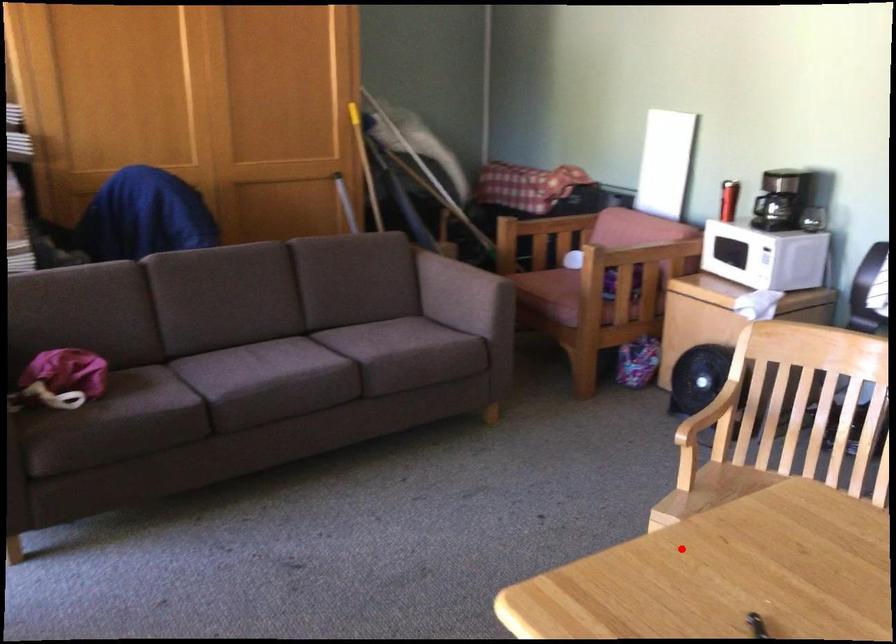
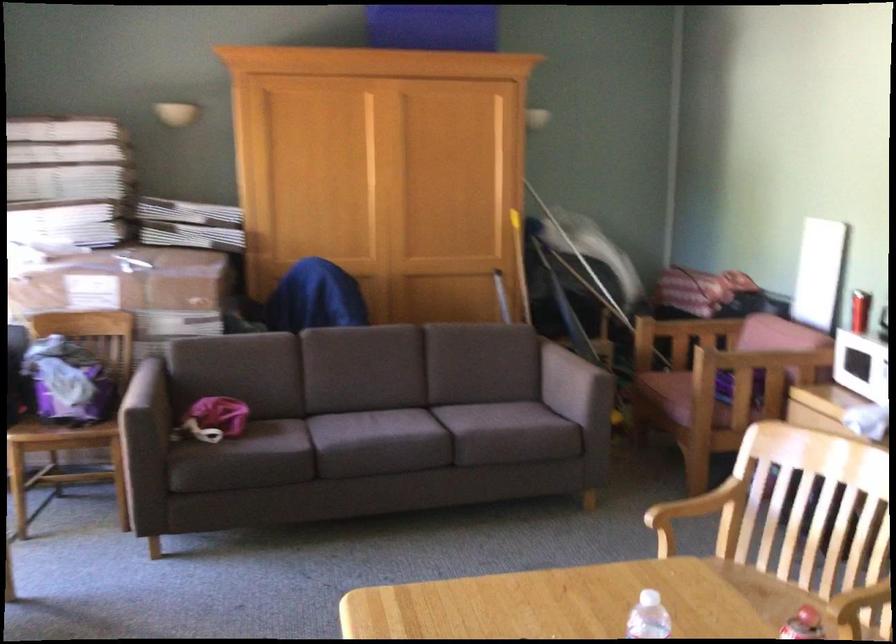
Where in the second image is the point corresponding to the highlighted location from the first image?

(555, 603)